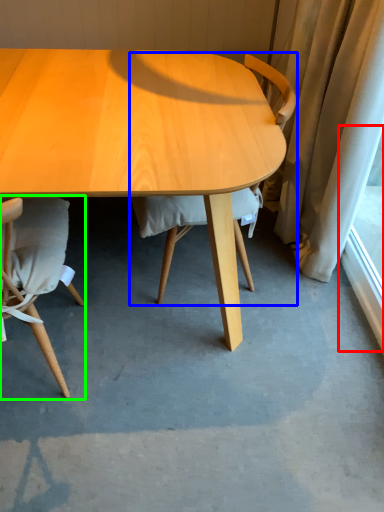
Question: Which object is the farthest from window screen (highlighted by a red box)? Choose among these: chair (highlighted by a blue box) or chair (highlighted by a green box).

Choices:
 (A) chair
 (B) chair

Answer: (B)